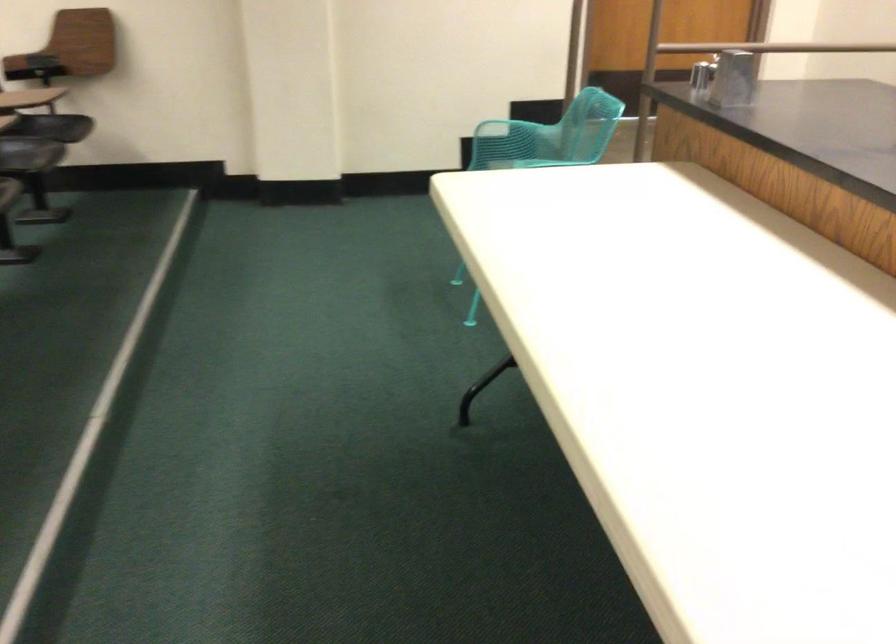
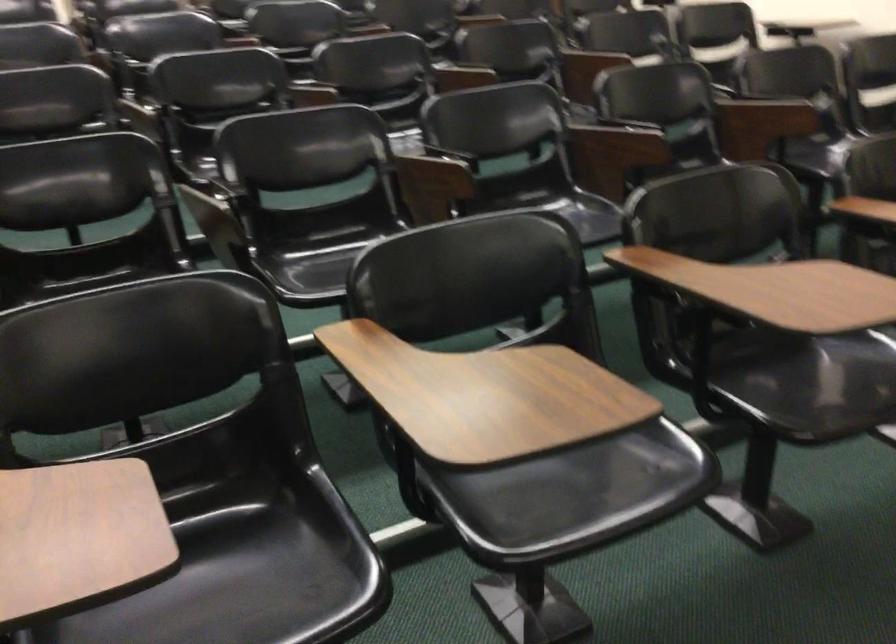
Question: The camera is either moving clockwise (left) or counter-clockwise (right) around the object. The first image is from the beginning of the video and the second image is from the end. Is the camera moving left or right when shooting the video?

Choices:
 (A) Left
 (B) Right

Answer: (B)